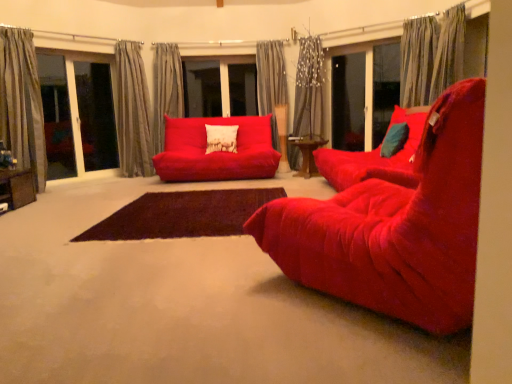
Question: From a real-world perspective, is transparent glass screen door at center, arranged as the first screen door when viewed from the left, positioned above or below velvet red chair at center?

Choices:
 (A) above
 (B) below

Answer: (A)

Question: Considering the positions of transparent glass screen door at center, arranged as the first screen door when viewed from the left, and velvet red chair at center in the image, is transparent glass screen door at center, arranged as the first screen door when viewed from the left, taller or shorter than velvet red chair at center?

Choices:
 (A) short
 (B) tall

Answer: (B)

Question: Estimate the real-world distances between objects in this image. Which object is farther from the brown rug at center?

Choices:
 (A) gray striped curtain at left, the sixth curtain from the right
 (B) matte glass screen door at center right, the 2th screen door when ordered from left to right
 (C) transparent glass screen door at center, marked as the 2th screen door in a right-to-left arrangement
 (D) velvet red chair at center
 (E) gray textured curtain at center, the fifth curtain viewed from the left

Answer: (C)

Question: Which object is positioned closest to the gray striped curtain at left, which is the 1th curtain in left-to-right order?

Choices:
 (A) matte glass screen door at center right, which is the first screen door from right to left
 (B) gray textured curtain at left, placed as the 2th curtain when sorted from left to right
 (C) brown rug at center
 (D) teal velvet pillow at right, positioned as the 1th pillow in front-to-back order
 (E) velvet red studio couch at center

Answer: (B)